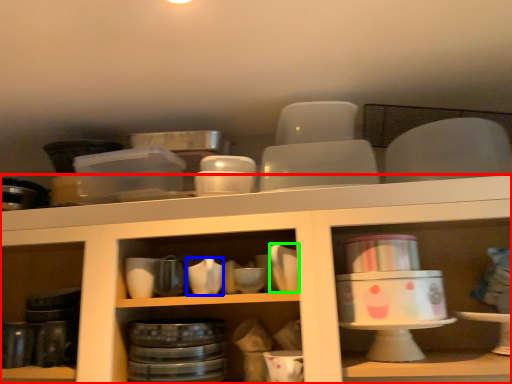
Question: Considering the real-world distances, which object is farthest from shelf (highlighted by a red box)? tableware (highlighted by a blue box) or tableware (highlighted by a green box)?

Choices:
 (A) tableware
 (B) tableware

Answer: (A)